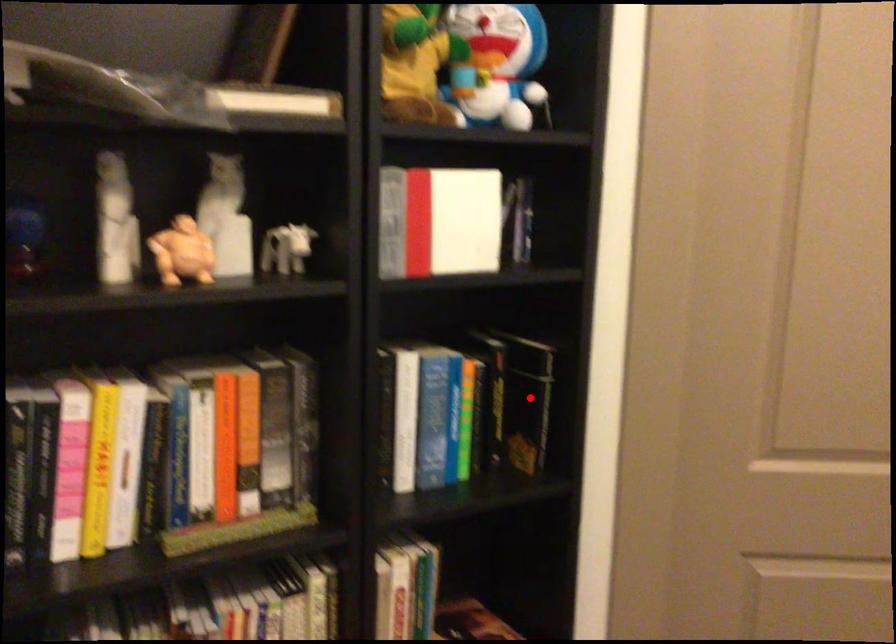
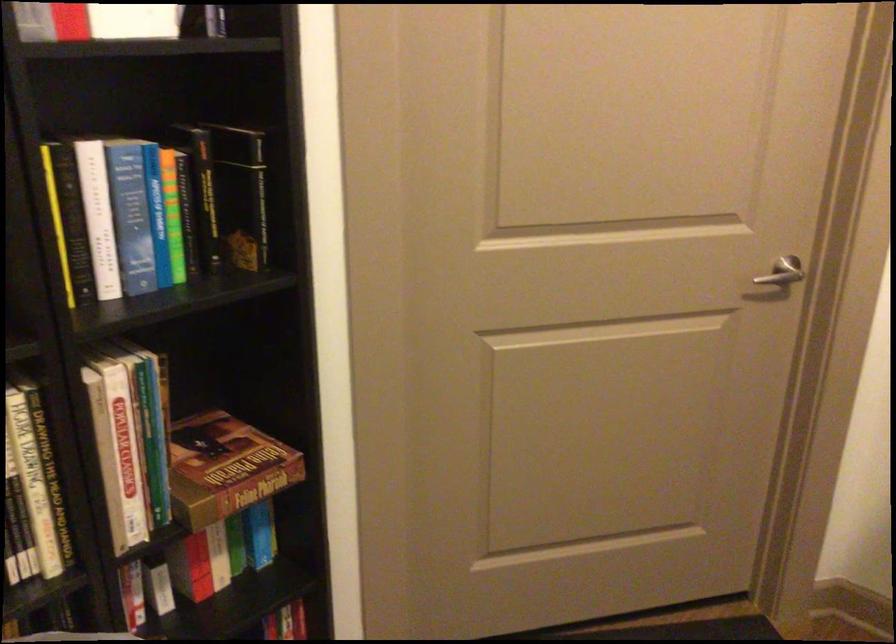
In the second image, find the point that corresponds to the highlighted location in the first image.

(240, 194)